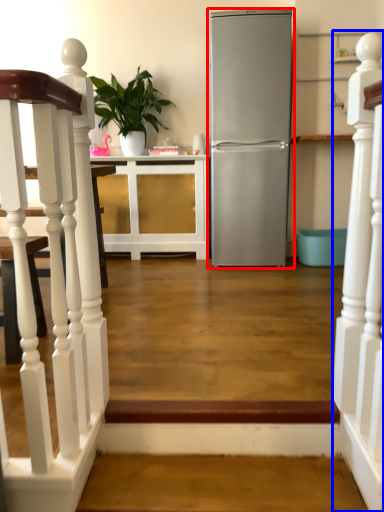
Question: Among these objects, which one is nearest to the camera, refrigerator (highlighted by a red box) or rail (highlighted by a blue box)?

Choices:
 (A) refrigerator
 (B) rail

Answer: (B)